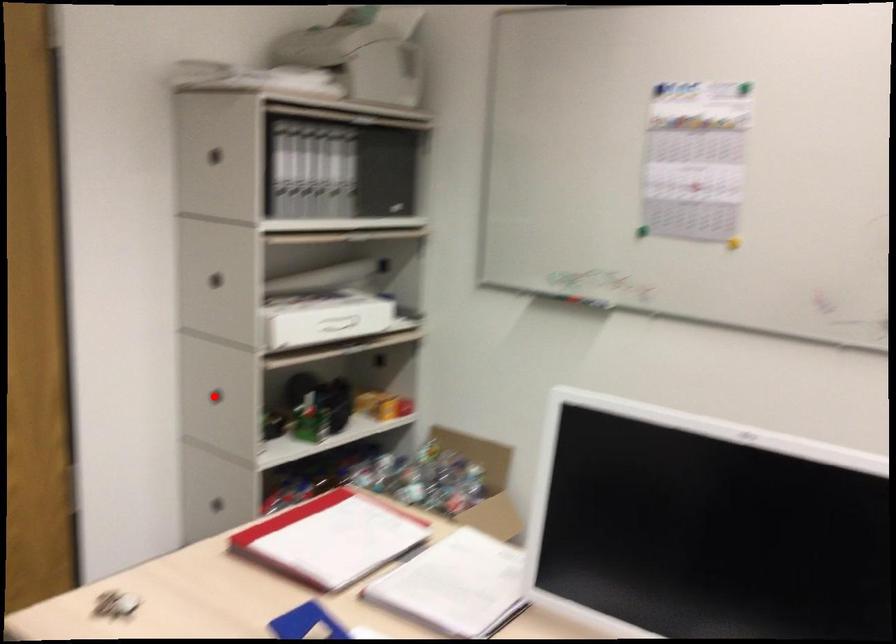
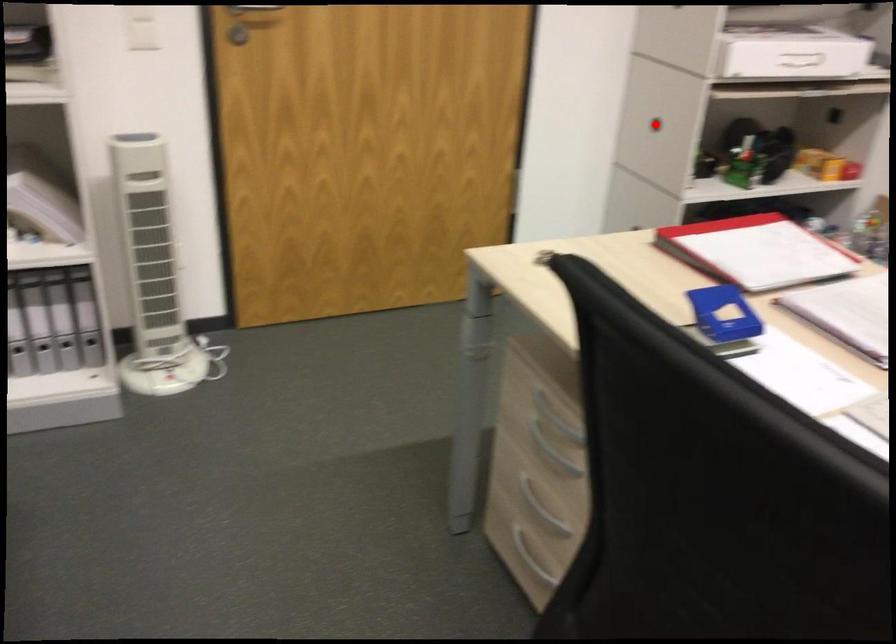
I am providing you with two images of the same scene from different viewpoints. A red point is marked on the first image and another point is marked on the second image. Are the points marked in image1 and image2 representing the same 3D position?

Yes